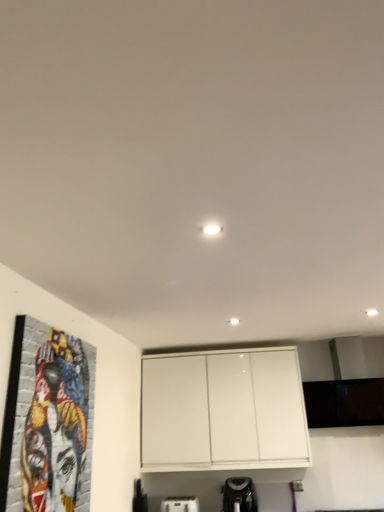
Question: Considering their positions, is white plastic toaster at lower center, the second appliance viewed from the right, located in front of or behind black plastic coffee maker at lower center, the second appliance viewed from the left?

Choices:
 (A) behind
 (B) front

Answer: (A)

Question: In terms of height, does white plastic toaster at lower center, the first appliance when ordered from left to right, look taller or shorter compared to black plastic coffee maker at lower center, the second appliance viewed from the left?

Choices:
 (A) short
 (B) tall

Answer: (A)

Question: Which object is positioned farthest from the white glossy cabinet at upper center?

Choices:
 (A) white plastic toaster at lower center, the first appliance when ordered from left to right
 (B) colorful mosaic portrait at left
 (C) black plastic coffee maker at lower center, the second appliance viewed from the left

Answer: (B)

Question: Which object is the closest to the white glossy cabinet at upper center?

Choices:
 (A) colorful mosaic portrait at left
 (B) black plastic coffee maker at lower center, the second appliance viewed from the left
 (C) white plastic toaster at lower center, the first appliance when ordered from left to right

Answer: (B)